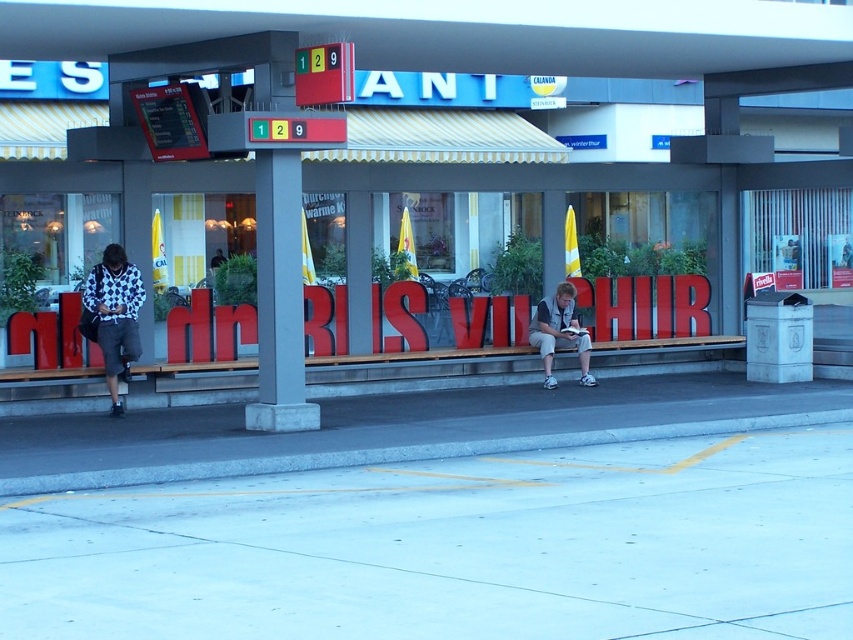
You are a traveler at the WINTERTHURS station and need to place your patterned fabric jacket at left on the gray concrete pillar at center. Is there enough space to do so?

The gray concrete pillar at center is larger in size than the patterned fabric jacket at left, so there should be enough space to place the patterned fabric jacket at left on the gray concrete pillar at center.

Consider the image. You are a maintenance worker at the station and need to place a 20 cm tall tool box on either the gray concrete curb at lower center or the gray concrete pillar at center. Which object can safely hold the tool box without it falling over?

The gray concrete pillar at center is taller than the gray concrete curb at lower center, so placing the tool box on the gray concrete pillar at center would provide a more stable and level surface, preventing it from tipping over.

From the picture: You are a traveler at the bus stop and need to place a small backpack between the gray concrete pillar at center and the patterned fabric jacket at left. Which object should you place the backpack closer to to ensure it doesn

The gray concrete pillar at center is much taller than the patterned fabric jacket at left, so placing the backpack closer to the gray concrete pillar at center would ensure it is more stable and less likely to fall over due to the height difference.